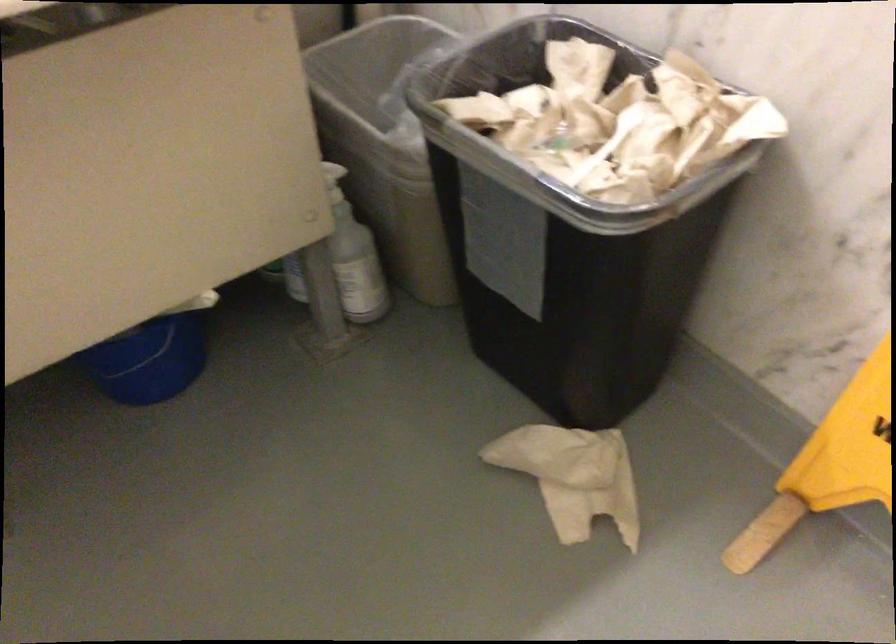
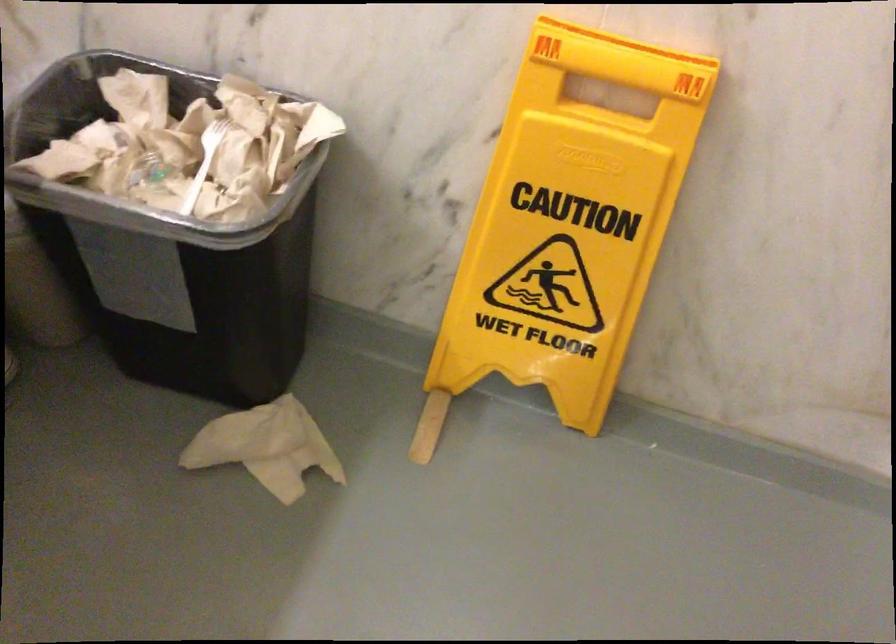
Question: How did the camera likely rotate?

Choices:
 (A) Left
 (B) Right
 (C) Up
 (D) Down

Answer: (B)